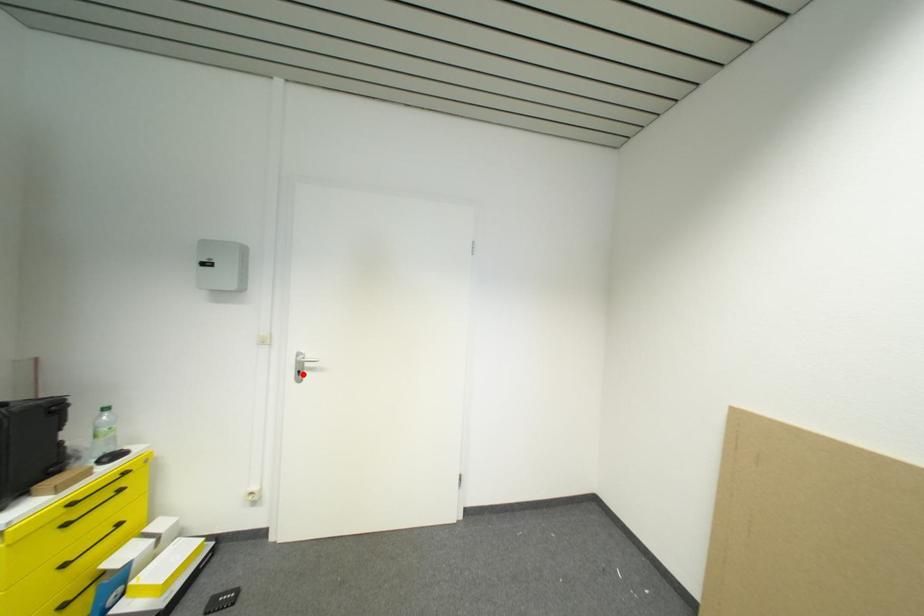
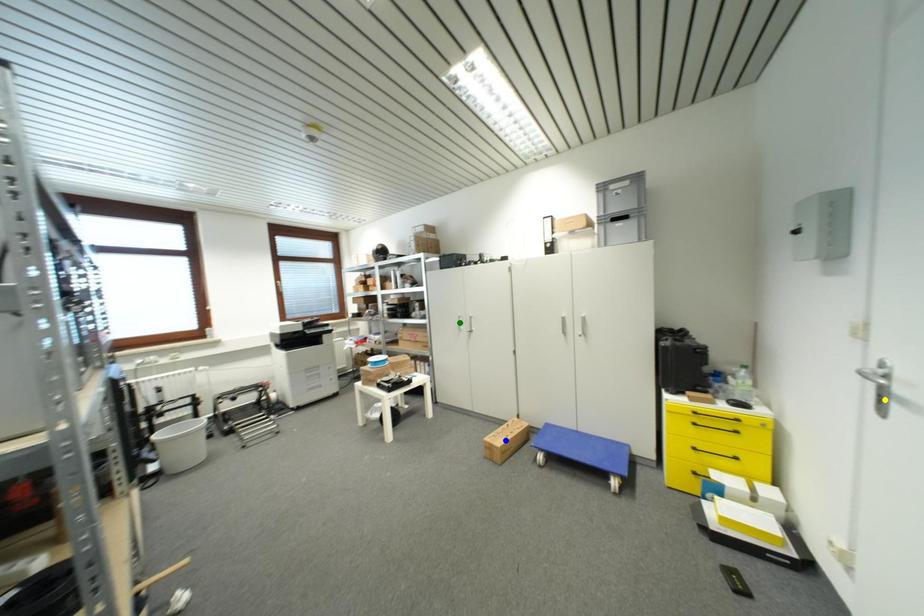
Question: I am providing you with two images of the same scene from different viewpoints. A red point is marked on the first image. You are given multiple points on the second image. Can you choose the point in image 2 that corresponds to the point in image 1?

Choices:
 (A) yellow point
 (B) green point
 (C) blue point

Answer: (A)